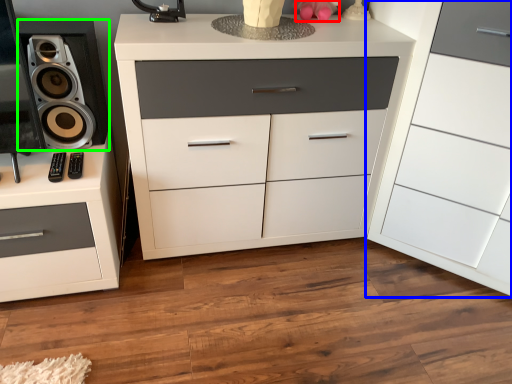
Question: Considering the real-world distances, which object is closest to toy (highlighted by a red box)? chest of drawers (highlighted by a blue box) or speaker (highlighted by a green box).

Choices:
 (A) chest of drawers
 (B) speaker

Answer: (A)